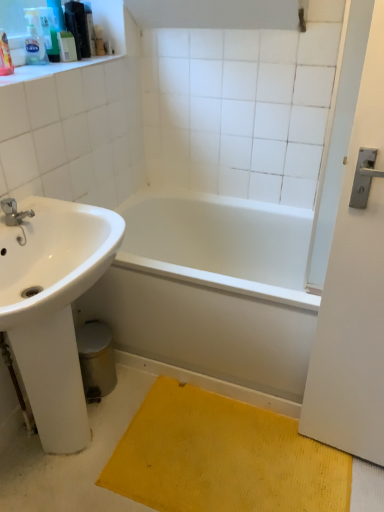
The height and width of the screenshot is (512, 384). I want to click on brushed metal faucet at left, so click(x=14, y=212).

How much space does white plastic container at upper left, which appears as the third toiletry when viewed from the left, occupy vertically?

white plastic container at upper left, which appears as the third toiletry when viewed from the left, is 5.55 inches in height.

Describe the element at coordinates (212, 289) in the screenshot. I see `white glossy bathtub at center` at that location.

This screenshot has width=384, height=512. What do you see at coordinates (49, 32) in the screenshot? I see `translucent plastic soap dispenser at upper left, the second toiletry viewed from the right` at bounding box center [49, 32].

The image size is (384, 512). Identify the location of brushed metal faucet at left. (14, 212).

Which of these two, white glossy sink at left or translucent plastic soap dispenser at upper left, which is counted as the 3th toiletry, starting from the right, is thinner?

Thinner between the two is translucent plastic soap dispenser at upper left, which is counted as the 3th toiletry, starting from the right.

Considering the positions of objects white glossy sink at left and translucent plastic soap dispenser at upper left, arranged as the 1th toiletry when viewed from the left, in the image provided, who is more to the left, white glossy sink at left or translucent plastic soap dispenser at upper left, arranged as the 1th toiletry when viewed from the left,?

Positioned to the left is translucent plastic soap dispenser at upper left, arranged as the 1th toiletry when viewed from the left.

From a real-world perspective, which is physically below, white glossy sink at left or translucent plastic soap dispenser at upper left, which is counted as the 3th toiletry, starting from the right?

white glossy sink at left.

Between white glossy sink at left and translucent plastic soap dispenser at upper left, which is counted as the 3th toiletry, starting from the right, which one has smaller size?

Smaller between the two is translucent plastic soap dispenser at upper left, which is counted as the 3th toiletry, starting from the right.

Considering the positions of objects white plastic container at upper left, which appears as the third toiletry when viewed from the left, and white glossy bathtub at center in the image provided, who is behind, white plastic container at upper left, which appears as the third toiletry when viewed from the left, or white glossy bathtub at center?

white plastic container at upper left, which appears as the third toiletry when viewed from the left, is behind.

How different are the orientations of white plastic container at upper left, the first toiletry when ordered from right to left, and white glossy bathtub at center in degrees?

They differ by 89.3 degrees in their facing directions.

Is white plastic container at upper left, which appears as the third toiletry when viewed from the left, to the left or to the right of white glossy bathtub at center in the image?

Clearly, white plastic container at upper left, which appears as the third toiletry when viewed from the left, is on the left of white glossy bathtub at center in the image.

Measure the distance between white plastic container at upper left, the first toiletry when ordered from right to left, and white glossy bathtub at center.

The distance of white plastic container at upper left, the first toiletry when ordered from right to left, from white glossy bathtub at center is 1.11 meters.

From a real-world perspective, is translucent plastic soap dispenser at upper left, the second toiletry viewed from the right, physically located above or below translucent plastic soap dispenser at upper left, which is counted as the 3th toiletry, starting from the right?

Clearly, from a real-world perspective, translucent plastic soap dispenser at upper left, the second toiletry viewed from the right, is above translucent plastic soap dispenser at upper left, which is counted as the 3th toiletry, starting from the right.

Can you confirm if translucent plastic soap dispenser at upper left, the second toiletry viewed from the right, is shorter than translucent plastic soap dispenser at upper left, arranged as the 1th toiletry when viewed from the left?

In fact, translucent plastic soap dispenser at upper left, the second toiletry viewed from the right, may be taller than translucent plastic soap dispenser at upper left, arranged as the 1th toiletry when viewed from the left.

Would you say translucent plastic soap dispenser at upper left, arranged as the 1th toiletry when viewed from the left, is part of translucent plastic soap dispenser at upper left, the second toiletry viewed from the right,'s contents?

No, translucent plastic soap dispenser at upper left, arranged as the 1th toiletry when viewed from the left, is not inside translucent plastic soap dispenser at upper left, the second toiletry viewed from the right.

Is translucent plastic soap dispenser at upper left, which is counted as the 2th toiletry, starting from the left, placed right next to translucent plastic soap dispenser at upper left, arranged as the 1th toiletry when viewed from the left?

Yes, translucent plastic soap dispenser at upper left, which is counted as the 2th toiletry, starting from the left, is touching translucent plastic soap dispenser at upper left, arranged as the 1th toiletry when viewed from the left.

Do you think white glossy sink at left is within white glossy bathtub at center, or outside of it?

white glossy sink at left is not enclosed by white glossy bathtub at center.

Find the location of a particular element. Image resolution: width=384 pixels, height=512 pixels. bathtub beneath the white glossy sink at left (from a real-world perspective) is located at coordinates (212, 289).

Is point (22, 367) more distant than point (148, 343)?

No, (22, 367) is in front of (148, 343).

Measure the distance from white glossy sink at left to white glossy bathtub at center.

A distance of 17.82 inches exists between white glossy sink at left and white glossy bathtub at center.

How many degrees apart are the facing directions of translucent plastic soap dispenser at upper left, which is counted as the 2th toiletry, starting from the left, and white plastic container at upper left, which appears as the third toiletry when viewed from the left?

translucent plastic soap dispenser at upper left, which is counted as the 2th toiletry, starting from the left, and white plastic container at upper left, which appears as the third toiletry when viewed from the left, are facing 0.00818 degrees away from each other.

Does translucent plastic soap dispenser at upper left, the second toiletry viewed from the right, have a larger size compared to white plastic container at upper left, which appears as the third toiletry when viewed from the left?

Yes.

Consider the image. From a real-world perspective, is translucent plastic soap dispenser at upper left, which is counted as the 2th toiletry, starting from the left, physically below white plastic container at upper left, the first toiletry when ordered from right to left?

Actually, translucent plastic soap dispenser at upper left, which is counted as the 2th toiletry, starting from the left, is physically above white plastic container at upper left, the first toiletry when ordered from right to left, in the real world.

Is translucent plastic soap dispenser at upper left, which is counted as the 2th toiletry, starting from the left, turned away from white plastic container at upper left, the first toiletry when ordered from right to left?

No.

In terms of height, does yellow textured mat at lower right look taller or shorter compared to translucent plastic soap dispenser at upper left, which is counted as the 2th toiletry, starting from the left?

Clearly, yellow textured mat at lower right is shorter compared to translucent plastic soap dispenser at upper left, which is counted as the 2th toiletry, starting from the left.

Are yellow textured mat at lower right and translucent plastic soap dispenser at upper left, the second toiletry viewed from the right, making contact?

There is a gap between yellow textured mat at lower right and translucent plastic soap dispenser at upper left, the second toiletry viewed from the right.

How far apart are yellow textured mat at lower right and translucent plastic soap dispenser at upper left, the second toiletry viewed from the right?

yellow textured mat at lower right and translucent plastic soap dispenser at upper left, the second toiletry viewed from the right, are 5.13 feet apart.

Is yellow textured mat at lower right outside of translucent plastic soap dispenser at upper left, which is counted as the 2th toiletry, starting from the left?

Yes, yellow textured mat at lower right is outside of translucent plastic soap dispenser at upper left, which is counted as the 2th toiletry, starting from the left.

Is white glossy bathtub at center facing towards brushed metal faucet at left?

No.

Is brushed metal faucet at left a part of white glossy bathtub at center?

No, brushed metal faucet at left is not surrounded by white glossy bathtub at center.

Is white glossy bathtub at center wider or thinner than brushed metal faucet at left?

In the image, white glossy bathtub at center appears to be wider than brushed metal faucet at left.

You are a GUI agent. You are given a task and a screenshot of the screen. Output one action in this format:
    pyautogui.click(x=<x>, y=<y>)
    Task: Click on the bathtub on the right of the brushed metal faucet at left
    
    Given the screenshot: What is the action you would take?
    pyautogui.click(x=212, y=289)

This screenshot has width=384, height=512. Identify the location of toiletry that is the 3rd object to the left of the white glossy sink at left, starting at the anchor. (34, 39).

Where is `bathtub in front of the white plastic container at upper left, the first toiletry when ordered from right to left`? The height and width of the screenshot is (512, 384). bathtub in front of the white plastic container at upper left, the first toiletry when ordered from right to left is located at coordinates (212, 289).

From the image, which object appears to be nearer to yellow textured mat at lower right, brushed metal faucet at left or white glossy bathtub at center?

Among the two, white glossy bathtub at center is located nearer to yellow textured mat at lower right.

Which object lies nearer to the anchor point translucent plastic soap dispenser at upper left, which is counted as the 2th toiletry, starting from the left, white plastic container at upper left, which appears as the third toiletry when viewed from the left, or yellow textured mat at lower right?

Based on the image, white plastic container at upper left, which appears as the third toiletry when viewed from the left, appears to be nearer to translucent plastic soap dispenser at upper left, which is counted as the 2th toiletry, starting from the left.

Estimate the real-world distances between objects in this image. Which object is further from white plastic container at upper left, which appears as the third toiletry when viewed from the left, yellow textured mat at lower right or translucent plastic soap dispenser at upper left, arranged as the 1th toiletry when viewed from the left?

yellow textured mat at lower right is positioned further to the anchor white plastic container at upper left, which appears as the third toiletry when viewed from the left.

When comparing their distances from translucent plastic soap dispenser at upper left, the second toiletry viewed from the right, does white glossy bathtub at center or yellow textured mat at lower right seem further?

yellow textured mat at lower right.

Estimate the real-world distances between objects in this image. Which object is closer to white glossy bathtub at center, white glossy sink at left or brushed metal faucet at left?

white glossy sink at left is closer to white glossy bathtub at center.

Looking at the image, which one is located closer to translucent plastic soap dispenser at upper left, the second toiletry viewed from the right, white glossy sink at left or white glossy bathtub at center?

white glossy sink at left is positioned closer to the anchor translucent plastic soap dispenser at upper left, the second toiletry viewed from the right.

Based on their spatial positions, is translucent plastic soap dispenser at upper left, arranged as the 1th toiletry when viewed from the left, or translucent plastic soap dispenser at upper left, the second toiletry viewed from the right, closer to brushed metal faucet at left?

translucent plastic soap dispenser at upper left, arranged as the 1th toiletry when viewed from the left.

Which object lies nearer to the anchor point translucent plastic soap dispenser at upper left, arranged as the 1th toiletry when viewed from the left, white plastic container at upper left, the first toiletry when ordered from right to left, or brushed metal faucet at left?

white plastic container at upper left, the first toiletry when ordered from right to left, is closer to translucent plastic soap dispenser at upper left, arranged as the 1th toiletry when viewed from the left.

Locate an element on the screen. The width and height of the screenshot is (384, 512). bathtub between translucent plastic soap dispenser at upper left, which is counted as the 3th toiletry, starting from the right, and yellow textured mat at lower right from top to bottom is located at coordinates (212, 289).

Find the location of `bathtub between white plastic container at upper left, the first toiletry when ordered from right to left, and yellow textured mat at lower right from top to bottom`. bathtub between white plastic container at upper left, the first toiletry when ordered from right to left, and yellow textured mat at lower right from top to bottom is located at coordinates (212, 289).

The height and width of the screenshot is (512, 384). Find the location of `tap between white plastic container at upper left, which appears as the third toiletry when viewed from the left, and white glossy bathtub at center in the up-down direction`. tap between white plastic container at upper left, which appears as the third toiletry when viewed from the left, and white glossy bathtub at center in the up-down direction is located at coordinates (14, 212).

Locate an element on the screen. toiletry between white plastic container at upper left, which appears as the third toiletry when viewed from the left, and white glossy bathtub at center in the up-down direction is located at coordinates tap(34, 39).